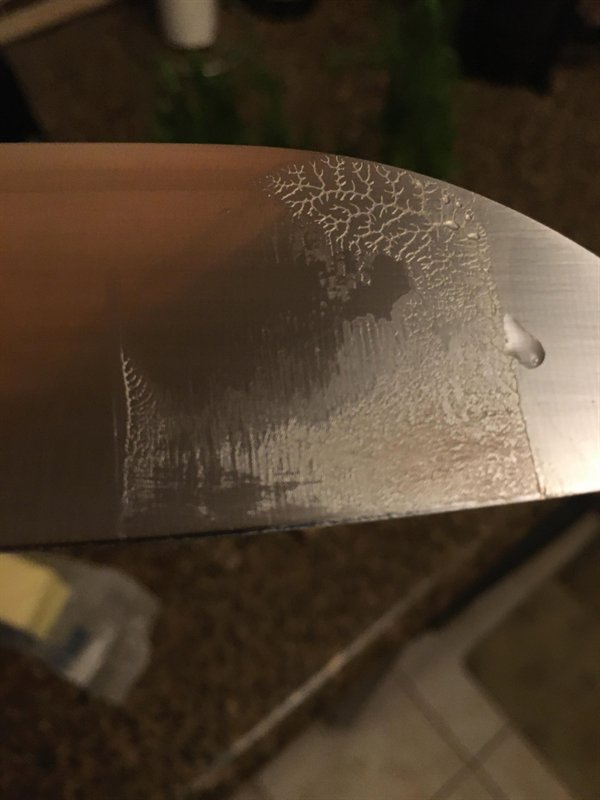
At what (x,y) coordinates should I click in order to perform the action: click on tile floor. Please return your answer as a coordinate pair (x, y). Looking at the image, I should click on (405, 770).